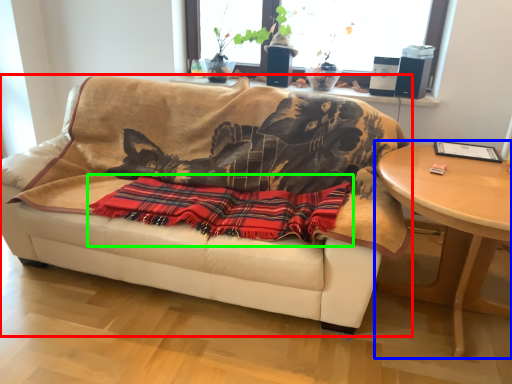
Question: Estimate the real-world distances between objects in this image. Which object is closer to studio couch (highlighted by a red box), table (highlighted by a blue box) or blanket (highlighted by a green box)?

Choices:
 (A) table
 (B) blanket

Answer: (B)